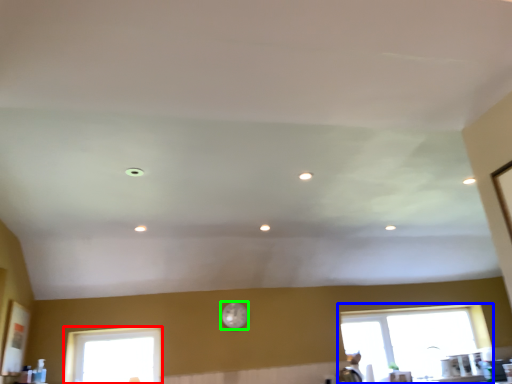
Question: Which is farther away from window (highlighted by a red box)? window (highlighted by a blue box) or clock (highlighted by a green box)?

Choices:
 (A) window
 (B) clock

Answer: (A)